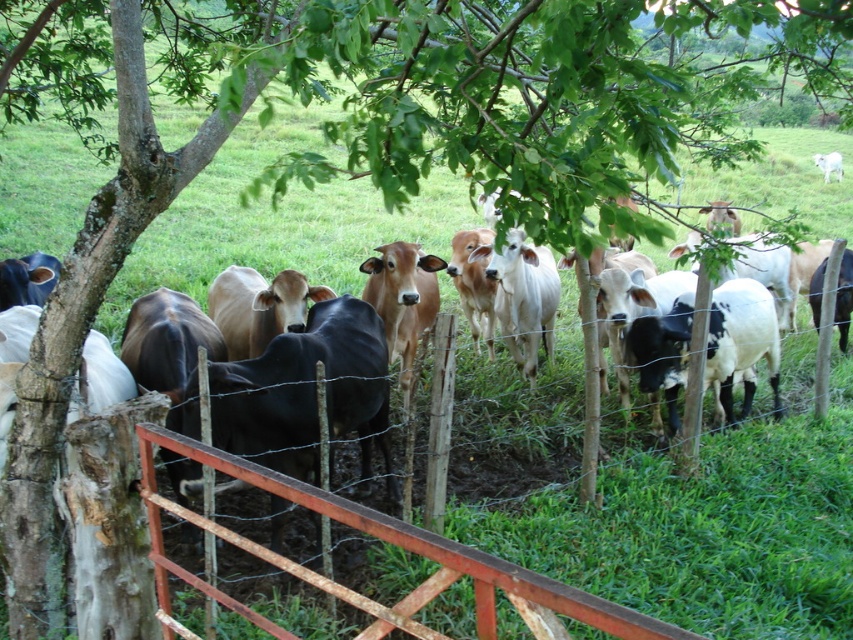
Identify the location of black and white spotted cow at center. (741, 342).

Does point (775, 396) lie in front of point (833, 170)?

Yes, it is in front of point (833, 170).

What are the coordinates of `black and white spotted cow at center` in the screenshot? It's located at (741, 342).